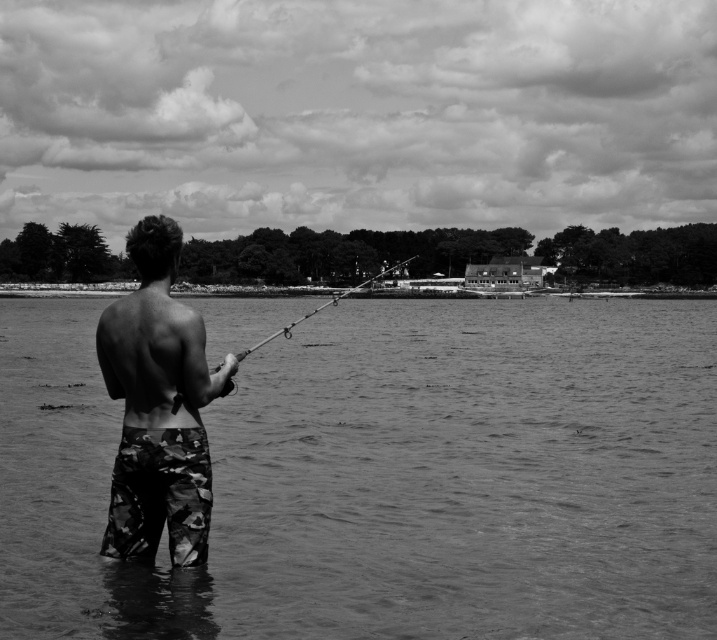
Question: Which object is farther from the camera taking this photo?

Choices:
 (A) smooth water at center
 (B) camo-patterned shorts at center

Answer: (A)

Question: Is smooth water at center bigger than camo-patterned shorts at center?

Choices:
 (A) yes
 (B) no

Answer: (A)

Question: From the image, what is the correct spatial relationship of smooth water at center in relation to camo-patterned shorts at center?

Choices:
 (A) right
 (B) left

Answer: (B)

Question: Among these objects, which one is farthest from the camera?

Choices:
 (A) smooth water at center
 (B) camo-patterned shorts at center

Answer: (A)

Question: Does smooth water at center appear on the left side of camo-patterned shorts at center?

Choices:
 (A) no
 (B) yes

Answer: (B)